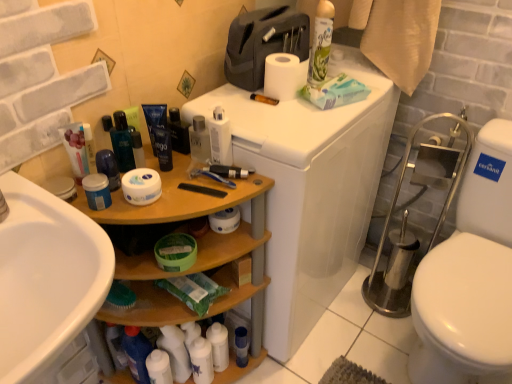
I want to click on free space to the right of blue plastic cup at lower center, placed as the first toiletry when sorted from right to left, so click(288, 364).